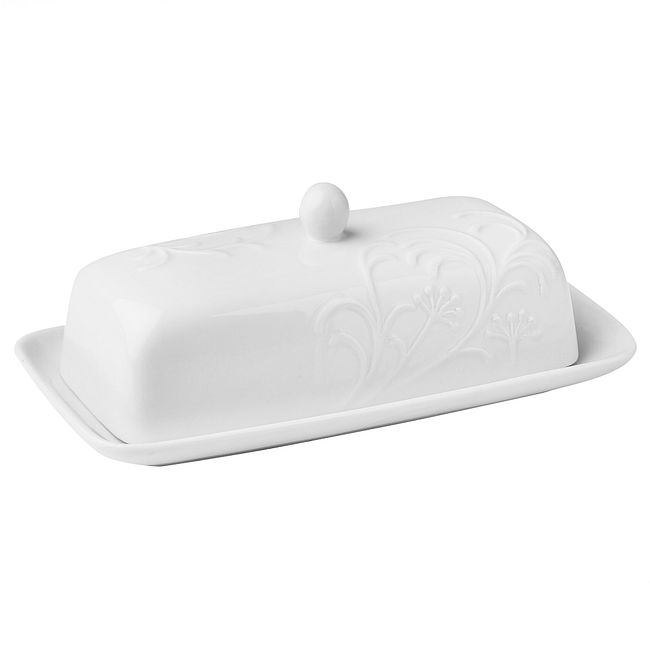
Locate an element on the screen. round handle is located at coordinates (330, 211).